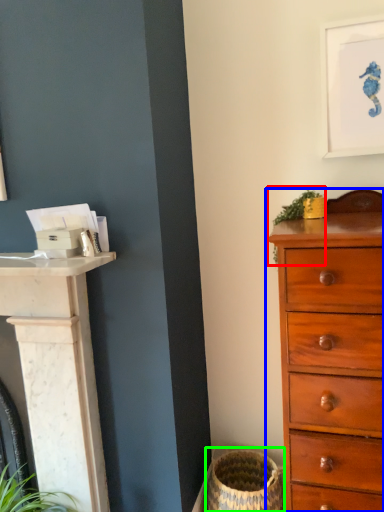
Question: Considering the real-world distances, which object is closest to plant (highlighted by a red box)? chest of drawers (highlighted by a blue box) or basket container (highlighted by a green box).

Choices:
 (A) chest of drawers
 (B) basket container

Answer: (A)